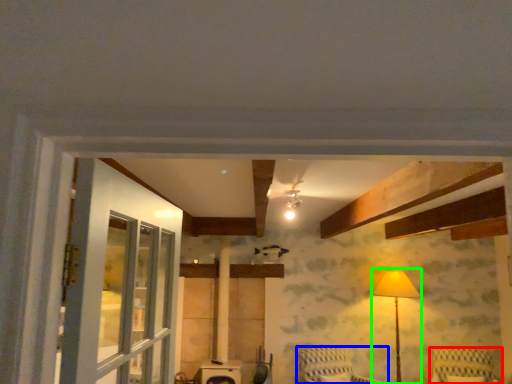
Question: Based on their relative distances, which object is nearer to furniture (highlighted by a red box)? Choose from furniture (highlighted by a blue box) and table lamp (highlighted by a green box).

Choices:
 (A) furniture
 (B) table lamp

Answer: (B)